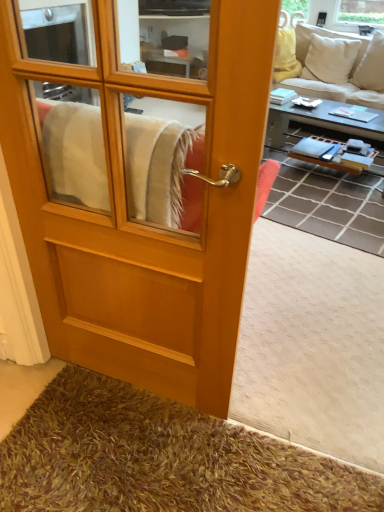
Question: Should I look upward or downward to see brown shaggy carpet at center?

Choices:
 (A) down
 (B) up

Answer: (B)

Question: Does wooden door at center have a lesser height compared to beige fabric couch at upper right?

Choices:
 (A) yes
 (B) no

Answer: (B)

Question: Considering the relative sizes of wooden door at center and beige fabric couch at upper right in the image provided, is wooden door at center thinner than beige fabric couch at upper right?

Choices:
 (A) no
 (B) yes

Answer: (B)

Question: From the image's perspective, is wooden door at center beneath beige fabric couch at upper right?

Choices:
 (A) no
 (B) yes

Answer: (B)

Question: Is wooden door at center taller than beige fabric couch at upper right?

Choices:
 (A) no
 (B) yes

Answer: (B)

Question: Is wooden door at center aimed at beige fabric couch at upper right?

Choices:
 (A) yes
 (B) no

Answer: (A)

Question: Considering the relative positions of wooden door at center and beige fabric couch at upper right in the image provided, is wooden door at center to the left of beige fabric couch at upper right from the viewer's perspective?

Choices:
 (A) no
 (B) yes

Answer: (B)

Question: Considering the relative sizes of beige fabric couch at upper right and wooden/textured coffee table at right in the image provided, is beige fabric couch at upper right thinner than wooden/textured coffee table at right?

Choices:
 (A) yes
 (B) no

Answer: (B)

Question: From a real-world perspective, does beige fabric couch at upper right sit lower than wooden/textured coffee table at right?

Choices:
 (A) no
 (B) yes

Answer: (A)

Question: Is beige fabric couch at upper right smaller than wooden/textured coffee table at right?

Choices:
 (A) yes
 (B) no

Answer: (B)

Question: Could you tell me if beige fabric couch at upper right is turned towards wooden/textured coffee table at right?

Choices:
 (A) yes
 (B) no

Answer: (A)

Question: Can you confirm if beige fabric couch at upper right is bigger than wooden/textured coffee table at right?

Choices:
 (A) yes
 (B) no

Answer: (A)

Question: Does beige fabric couch at upper right come behind wooden/textured coffee table at right?

Choices:
 (A) yes
 (B) no

Answer: (A)

Question: Would you say brown shaggy carpet at center is part of beige fabric couch at upper right's contents?

Choices:
 (A) no
 (B) yes

Answer: (A)